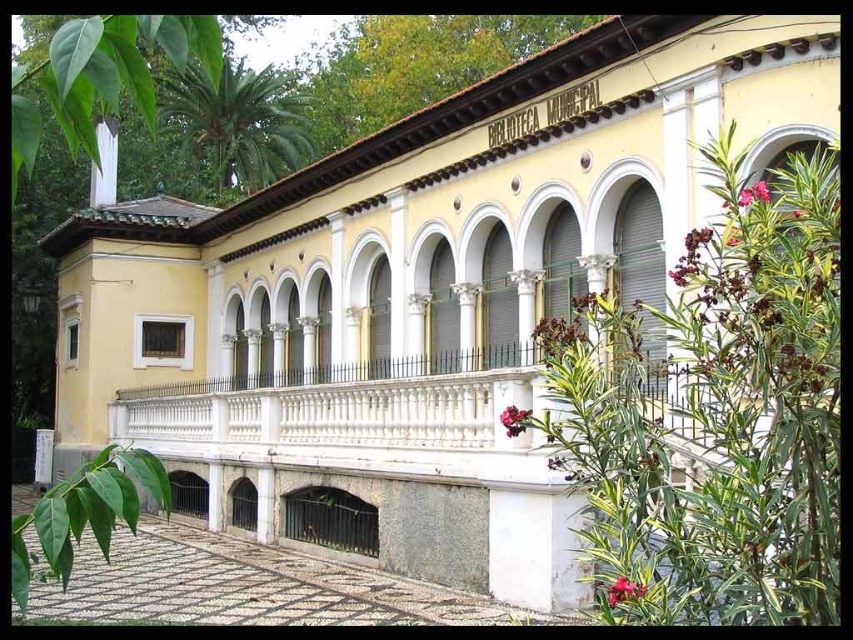
You are standing at the entrance of the two story building and want to see both the gray concrete courtyard at lower center and the pink matte flower at lower right. Which object is taller when viewed from this position?

The gray concrete courtyard at lower center is taller than the pink matte flower at lower right.

You are a visitor standing in front of the building and want to take a photo of both the gray concrete courtyard at lower center and the pink matte flower at center. Which object will occupy more space in your camera frame?

The gray concrete courtyard at lower center is larger in size than the pink matte flower at center, so it will occupy more space in your camera frame.